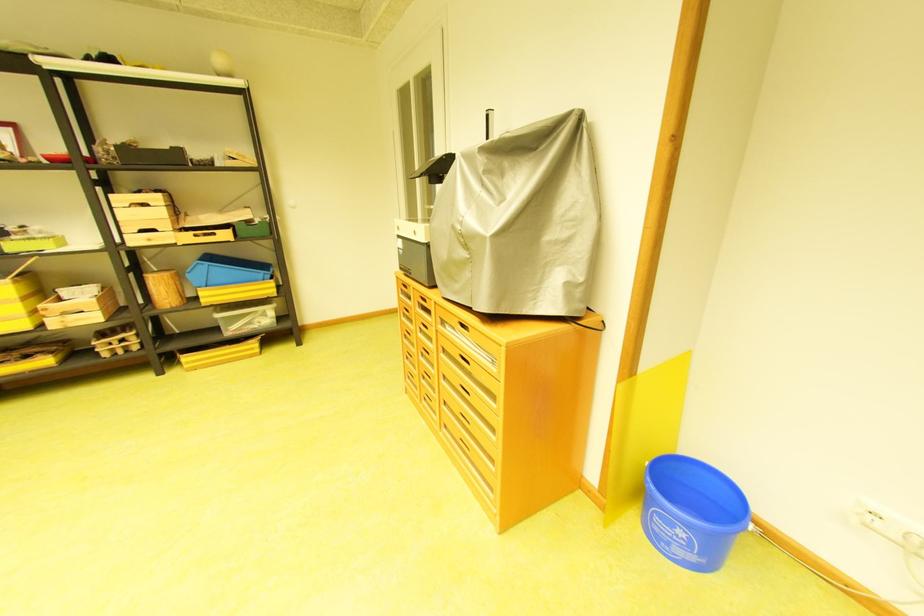
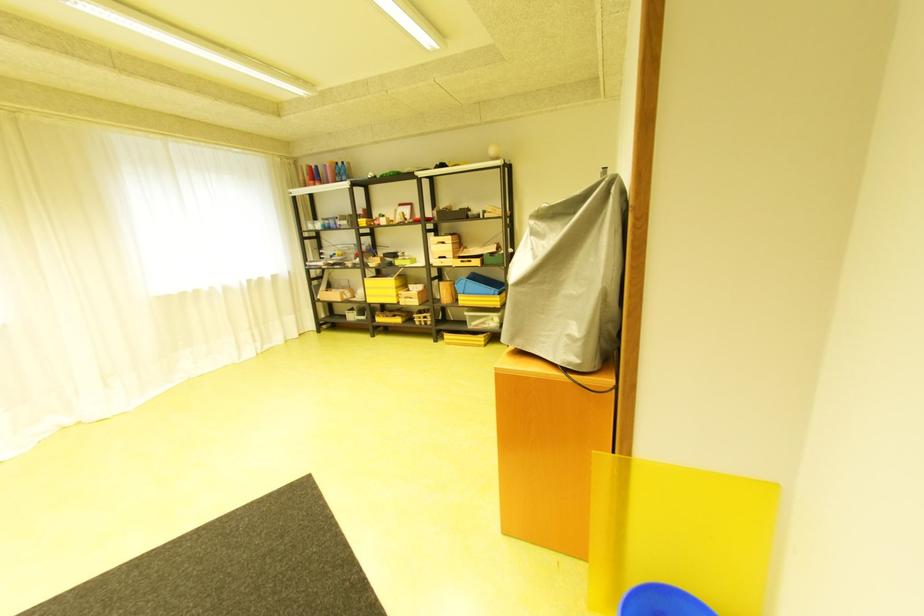
Question: How did the camera likely rotate?

Choices:
 (A) Left
 (B) Right
 (C) Up
 (D) Down

Answer: (A)